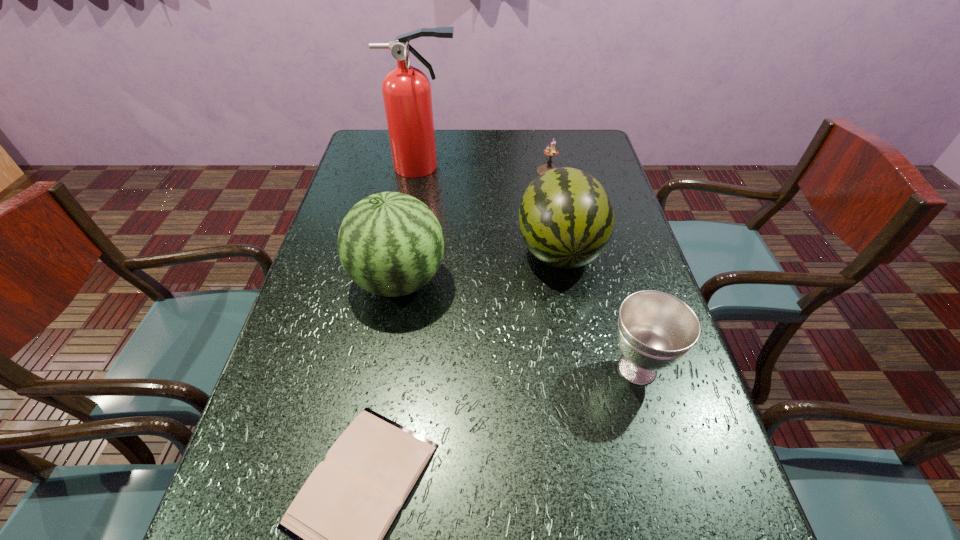
At what (x,y) coordinates should I click in order to perform the action: click on object located at the far left corner. Please return your answer as a coordinate pair (x, y). The width and height of the screenshot is (960, 540). Looking at the image, I should click on (406, 90).

The image size is (960, 540). Identify the location of object situated at the far right corner. (549, 151).

Find the location of a particular element. The image size is (960, 540). vacant region at the far edge of the desktop is located at coordinates (457, 136).

In the image, there is a desktop. At what (x,y) coordinates should I click in order to perform the action: click on free region at the right edge. Please return your answer as a coordinate pair (x, y). The height and width of the screenshot is (540, 960). Looking at the image, I should click on (698, 432).

The height and width of the screenshot is (540, 960). What are the coordinates of `free space at the far right corner of the desktop` in the screenshot? It's located at (572, 150).

At what (x,y) coordinates should I click in order to perform the action: click on unoccupied area between the left watermelon and the candle holder. Please return your answer as a coordinate pair (x, y). Image resolution: width=960 pixels, height=540 pixels. Looking at the image, I should click on (473, 226).

Locate an element on the screen. The height and width of the screenshot is (540, 960). unoccupied area between the right watermelon and the fourth tallest object is located at coordinates tap(598, 309).

Find the location of a particular element. The width and height of the screenshot is (960, 540). vacant space that is in between the taller watermelon and the right watermelon is located at coordinates (479, 266).

This screenshot has height=540, width=960. Find the location of `blank region between the chalice and the left watermelon`. blank region between the chalice and the left watermelon is located at coordinates (518, 325).

Locate an element on the screen. Image resolution: width=960 pixels, height=540 pixels. free point between the right watermelon and the second tallest object is located at coordinates (479, 266).